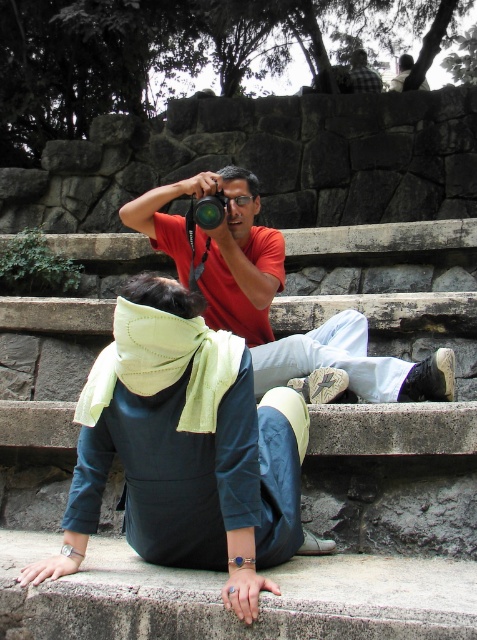
Does matte red shirt at center have a larger size compared to matte black camera at center?

Indeed, matte red shirt at center has a larger size compared to matte black camera at center.

Between matte red shirt at center and matte black camera at center, which one is positioned higher?

matte black camera at center

Which is in front, point (179, 257) or point (208, 211)?

Point (208, 211) is in front.

Locate an element on the screen. Image resolution: width=477 pixels, height=640 pixels. matte red shirt at center is located at coordinates (272, 296).